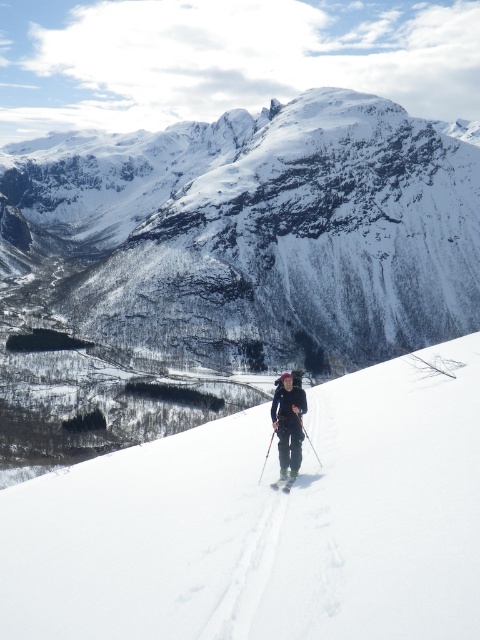
In the scene shown: Is white snow-covered mountain at upper center above dark gray fabric jacket at center?

Yes.

Does white snow-covered mountain at upper center have a smaller size compared to dark gray fabric jacket at center?

No, white snow-covered mountain at upper center is not smaller than dark gray fabric jacket at center.

Which is in front, point (451, 269) or point (278, 456)?

Point (278, 456)

The image size is (480, 640). What are the coordinates of `white snow-covered mountain at upper center` in the screenshot? It's located at (250, 230).

Is dark gray fabric jacket at center bigger than black plastic ski pole at center?

Yes.

Which is more to the left, dark gray fabric jacket at center or black plastic ski pole at center?

From the viewer's perspective, dark gray fabric jacket at center appears more on the left side.

Does point (286, 486) lie behind point (300, 424)?

No.

Image resolution: width=480 pixels, height=640 pixels. In order to click on dark gray fabric jacket at center in this screenshot , I will do `click(288, 426)`.

Is point (298, 419) more distant than point (266, 456)?

That is False.

Which is above, black plastic ski pole at center or silver metallic ski pole at center?

black plastic ski pole at center

Between point (302, 428) and point (271, 438), which one is positioned in front?

Positioned in front is point (302, 428).

Image resolution: width=480 pixels, height=640 pixels. Find the location of `black plastic ski pole at center`. black plastic ski pole at center is located at coordinates (307, 435).